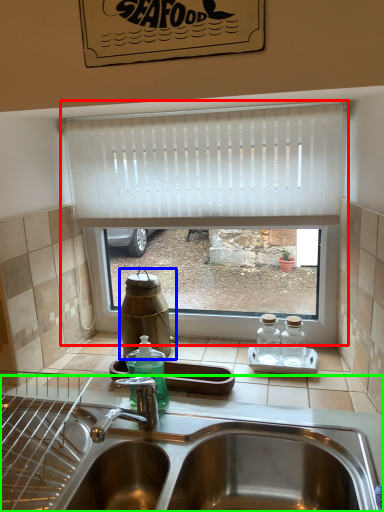
Question: Which object is the farthest from window (highlighted by a red box)? Choose among these: bottle (highlighted by a blue box) or sink (highlighted by a green box).

Choices:
 (A) bottle
 (B) sink

Answer: (B)